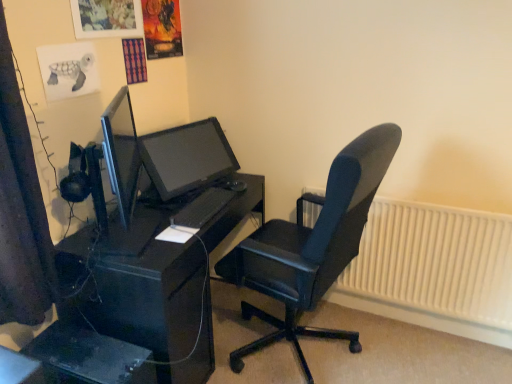
Question: Is black matte keyboard at center wider than black plastic computer tower at lower left?

Choices:
 (A) no
 (B) yes

Answer: (A)

Question: Is black matte keyboard at center turned away from black plastic computer tower at lower left?

Choices:
 (A) yes
 (B) no

Answer: (B)

Question: Is black plastic computer tower at lower left a part of black matte keyboard at center?

Choices:
 (A) no
 (B) yes

Answer: (A)

Question: From a real-world perspective, is black matte keyboard at center positioned over black plastic computer tower at lower left based on gravity?

Choices:
 (A) no
 (B) yes

Answer: (B)

Question: From a real-world perspective, is black matte keyboard at center under black plastic computer tower at lower left?

Choices:
 (A) no
 (B) yes

Answer: (A)

Question: Would you say watercolor paper turtle at upper left is to the left or to the right of black plastic computer tower at lower left in the picture?

Choices:
 (A) left
 (B) right

Answer: (A)

Question: Considering the positions of watercolor paper turtle at upper left and black plastic computer tower at lower left in the image, is watercolor paper turtle at upper left taller or shorter than black plastic computer tower at lower left?

Choices:
 (A) tall
 (B) short

Answer: (B)

Question: Considering their positions, is watercolor paper turtle at upper left located in front of or behind black plastic computer tower at lower left?

Choices:
 (A) front
 (B) behind

Answer: (B)

Question: From the image's perspective, is watercolor paper turtle at upper left positioned above or below black plastic computer tower at lower left?

Choices:
 (A) above
 (B) below

Answer: (A)

Question: In terms of height, does black matte keyboard at center look taller or shorter compared to black leather office chair at center?

Choices:
 (A) tall
 (B) short

Answer: (B)

Question: Is point (174, 228) positioned closer to the camera than point (313, 235)?

Choices:
 (A) closer
 (B) farther

Answer: (B)

Question: Considering the positions of black matte keyboard at center and black leather office chair at center in the image, is black matte keyboard at center bigger or smaller than black leather office chair at center?

Choices:
 (A) big
 (B) small

Answer: (B)

Question: In the image, is black matte keyboard at center positioned in front of or behind black leather office chair at center?

Choices:
 (A) front
 (B) behind

Answer: (B)

Question: Is black matte keyboard at center wider or thinner than black plastic computer tower at lower left?

Choices:
 (A) wide
 (B) thin

Answer: (B)

Question: From a real-world perspective, is black matte keyboard at center above or below black plastic computer tower at lower left?

Choices:
 (A) above
 (B) below

Answer: (A)